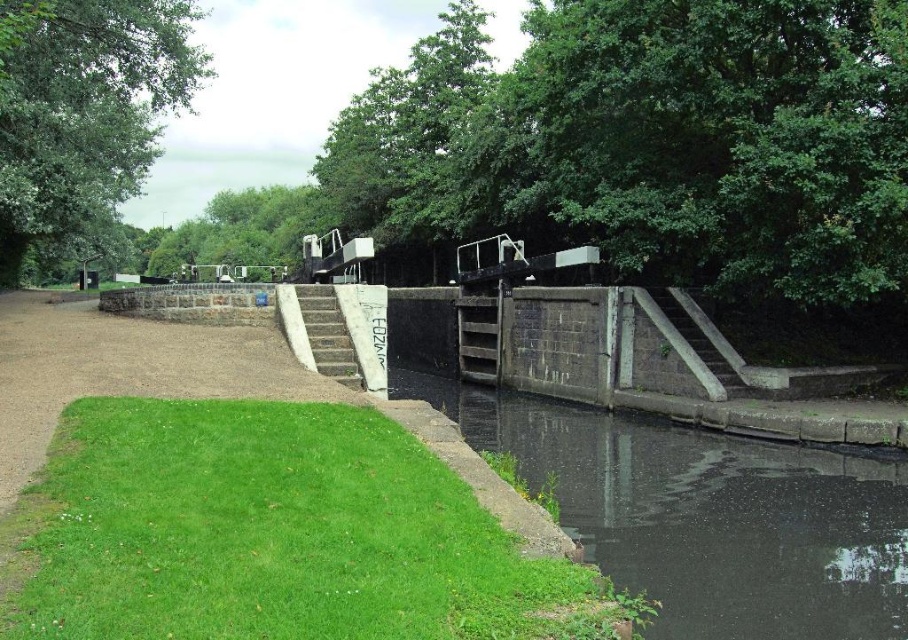
Question: Which point appears closest to the camera in this image?

Choices:
 (A) (316, 364)
 (B) (135, 96)
 (C) (600, 445)

Answer: (A)

Question: Which object is closer to the camera taking this photo?

Choices:
 (A) green leafy tree at upper left
 (B) dark concrete water at center

Answer: (B)

Question: Is green leafy tree at upper left smaller than concrete stairs at center?

Choices:
 (A) no
 (B) yes

Answer: (A)

Question: Is green leafy tree at upper left above concrete stairs at center?

Choices:
 (A) yes
 (B) no

Answer: (A)

Question: Can you confirm if dark concrete water at center is thinner than concrete stairs at center?

Choices:
 (A) no
 (B) yes

Answer: (A)

Question: Which object is closer to the camera taking this photo?

Choices:
 (A) dark concrete water at center
 (B) concrete stairs at center

Answer: (A)